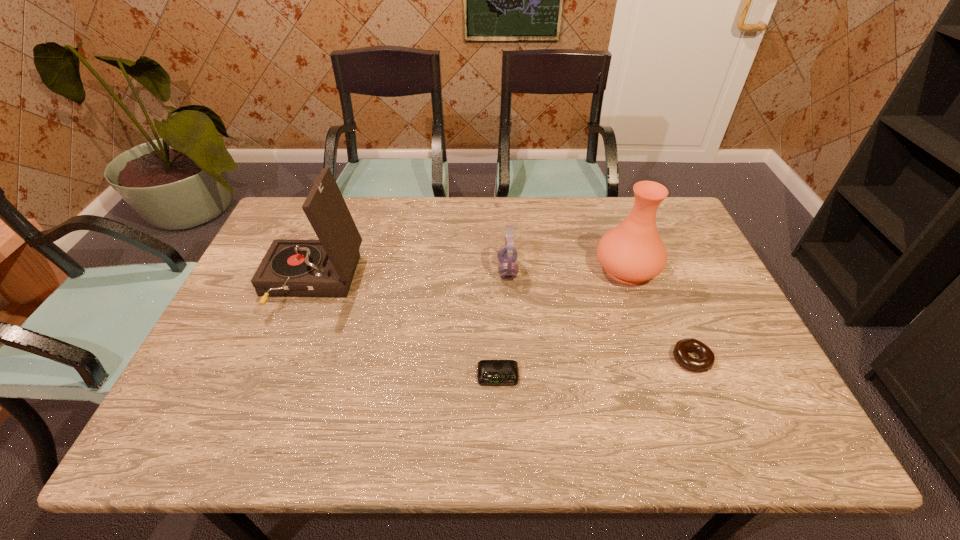
Identify the location of free space located on the left of the fourth tallest object. (630, 359).

At what (x,y) coordinates should I click in order to perform the action: click on vacant area situated on the display of the shortest object. Please return your answer as a coordinate pair (x, y). The width and height of the screenshot is (960, 540). Looking at the image, I should click on (499, 411).

Locate an element on the screen. The width and height of the screenshot is (960, 540). object at the left edge is located at coordinates (291, 268).

Find the location of a particular element. This screenshot has width=960, height=540. vase that is positioned at the right edge is located at coordinates (x=632, y=252).

Locate an element on the screen. This screenshot has height=540, width=960. doughnut located in the right edge section of the desktop is located at coordinates (707, 358).

At what (x,y) coordinates should I click in order to perform the action: click on free space at the far edge of the desktop. Please return your answer as a coordinate pair (x, y). Image resolution: width=960 pixels, height=540 pixels. Looking at the image, I should click on (462, 202).

The height and width of the screenshot is (540, 960). I want to click on free space at the near edge of the desktop, so click(376, 423).

Find the location of a particular element. free space at the left edge is located at coordinates (260, 305).

Identify the location of vacant space at the right edge of the desktop. (717, 328).

In the image, there is a desktop. Where is `vacant space at the far right corner`? This screenshot has height=540, width=960. vacant space at the far right corner is located at coordinates (681, 213).